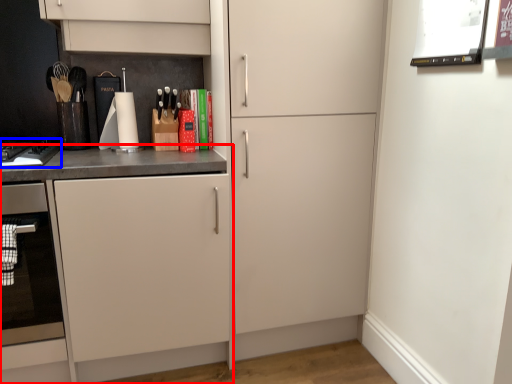
Question: Which point is closer to the camera, cabinetry (highlighted by a red box) or home appliance (highlighted by a blue box)?

Choices:
 (A) cabinetry
 (B) home appliance

Answer: (A)